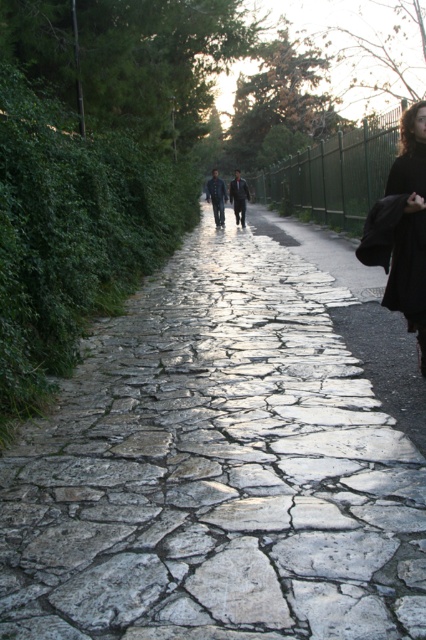
You are standing on the cobblestone pathway and see the cracked stone pavement at center and the black wool coat at right. If you walk forward, which object will you encounter first?

The cracked stone pavement at center is in front of the black wool coat at right, so you will encounter the cracked stone pavement at center first.

You are standing at the beginning of the cobblestone pathway and see the black matte dress at right. If you want to reach the dress quickly, should you walk along the path or take a shortcut through the greenery on the left?

The black matte dress at right is 4.75 meters from the viewer. Walking along the path would be the most efficient route since the path is a clear, direct path to the dress, while the greenery on the left may have obstacles or uneven terrain that could slow you down.